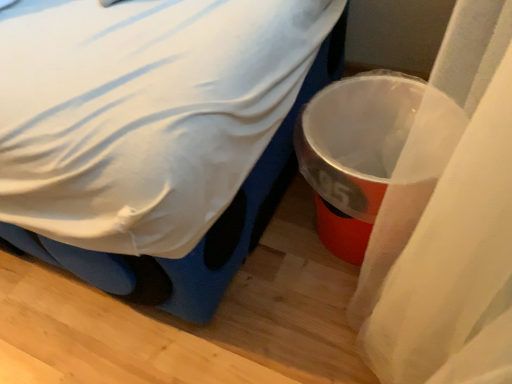
Question: From the image's perspective, is metallic plastic trash can at right on top of white fabric bed at center?

Choices:
 (A) no
 (B) yes

Answer: (A)

Question: Considering the relative sizes of metallic plastic trash can at right and white fabric bed at center in the image provided, is metallic plastic trash can at right smaller than white fabric bed at center?

Choices:
 (A) yes
 (B) no

Answer: (A)

Question: Is metallic plastic trash can at right facing away from white fabric bed at center?

Choices:
 (A) yes
 (B) no

Answer: (B)

Question: From a real-world perspective, is metallic plastic trash can at right over white fabric bed at center?

Choices:
 (A) no
 (B) yes

Answer: (A)

Question: From the image's perspective, is metallic plastic trash can at right beneath white fabric bed at center?

Choices:
 (A) no
 (B) yes

Answer: (B)

Question: Does metallic plastic trash can at right have a greater width compared to white fabric bed at center?

Choices:
 (A) no
 (B) yes

Answer: (A)

Question: From a real-world perspective, does white fabric bed at center stand above metallic plastic trash can at right?

Choices:
 (A) no
 (B) yes

Answer: (B)

Question: From a real-world perspective, does white fabric bed at center sit lower than metallic plastic trash can at right?

Choices:
 (A) no
 (B) yes

Answer: (A)

Question: Would you say white fabric bed at center contains metallic plastic trash can at right?

Choices:
 (A) yes
 (B) no

Answer: (B)

Question: Can you confirm if white fabric bed at center is taller than metallic plastic trash can at right?

Choices:
 (A) yes
 (B) no

Answer: (A)

Question: Does white fabric bed at center have a lesser width compared to metallic plastic trash can at right?

Choices:
 (A) no
 (B) yes

Answer: (A)

Question: Is white fabric bed at center behind metallic plastic trash can at right?

Choices:
 (A) yes
 (B) no

Answer: (B)

Question: Is white fabric bed at center in front of or behind metallic plastic trash can at right in the image?

Choices:
 (A) behind
 (B) front

Answer: (B)